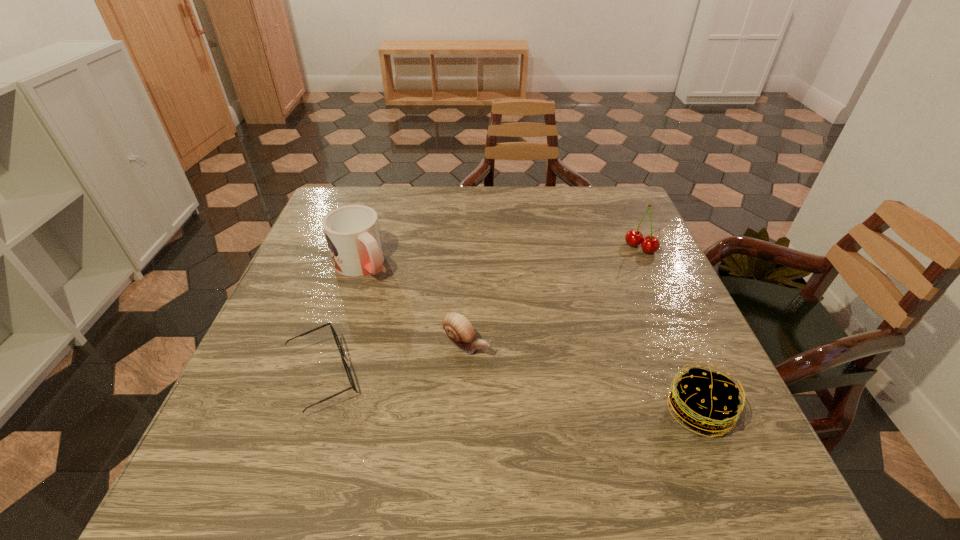
This screenshot has width=960, height=540. I want to click on vacant region between the escargot and the mug, so click(414, 305).

Locate which object is the fourth closest to the spectacles. Please provide its 2D coordinates. Your answer should be formatted as a tuple, i.e. [(x, y)], where the tuple contains the x and y coordinates of a point satisfying the conditions above.

[(649, 244)]

Locate which object is the third closest to the spectacles. Please provide its 2D coordinates. Your answer should be formatted as a tuple, i.e. [(x, y)], where the tuple contains the x and y coordinates of a point satisfying the conditions above.

[(705, 400)]